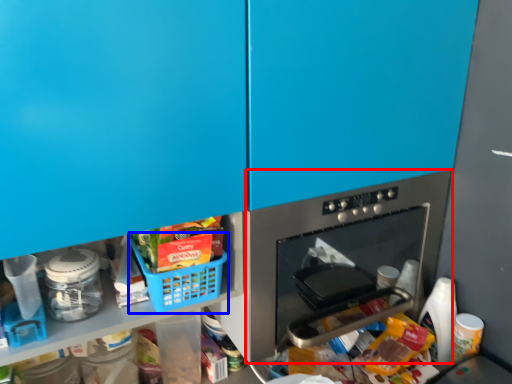
Question: Among these objects, which one is nearest to the camera, home appliance (highlighted by a red box) or basket (highlighted by a blue box)?

Choices:
 (A) home appliance
 (B) basket

Answer: (B)